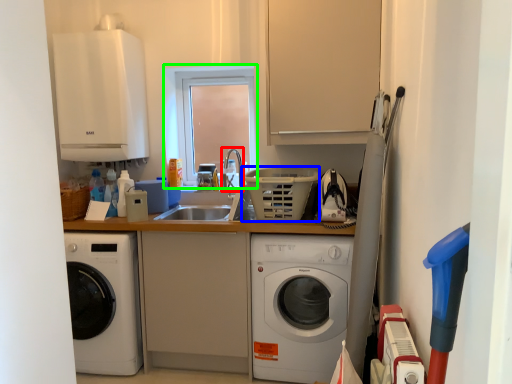
Question: Which is nearer to the faucet (highlighted by a red box)? basket (highlighted by a blue box) or window (highlighted by a green box).

Choices:
 (A) basket
 (B) window

Answer: (B)